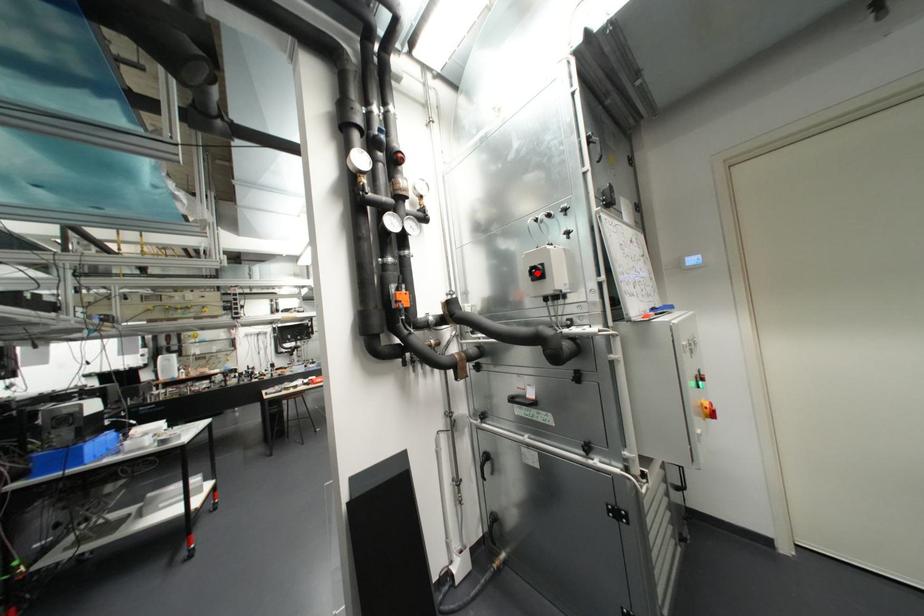
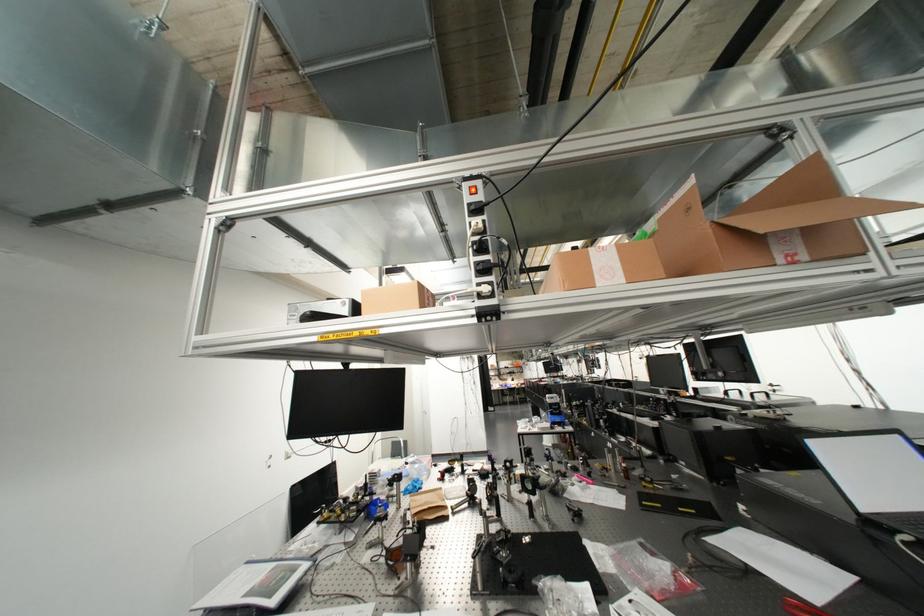
Question: I am providing you with two images of the same scene from different viewpoints. A red point is marked on the first image. At the location where the point appears in image 1, is it still visible in image 2?

Choices:
 (A) Yes
 (B) No

Answer: (B)